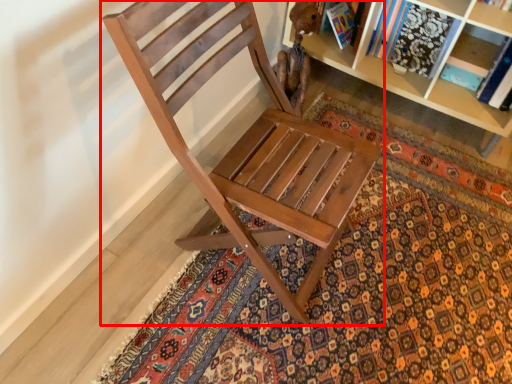
Question: Observing the image, what is the correct spatial positioning of chair (annotated by the red box) in reference to doormat?

Choices:
 (A) left
 (B) right

Answer: (A)